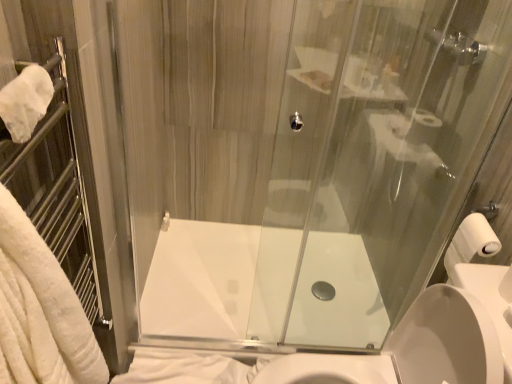
Measure the distance between point (166, 217) and camera.

Point (166, 217) and camera are 7.35 feet apart from each other.

Locate an element on the screen. The image size is (512, 384). white matte towel bar at upper left is located at coordinates (165, 221).

Image resolution: width=512 pixels, height=384 pixels. I want to click on white matte toilet paper at right, so click(x=470, y=244).

Identify the location of toilet paper above the white soft towel at lower left, which is the first bath towel in back-to-front order (from the image's perspective). (470, 244).

Which is more to the right, white matte toilet paper at right or white soft towel at lower left, the 2th bath towel viewed from the top?

white matte toilet paper at right is more to the right.

Does white matte toilet paper at right have a larger size compared to white soft towel at lower left, the 2th bath towel viewed from the top?

Actually, white matte toilet paper at right might be smaller than white soft towel at lower left, the 2th bath towel viewed from the top.

Does point (450, 332) come behind point (36, 324)?

Yes.

In the scene shown: In the image, is white glossy sink at center positioned in front of or behind white soft towel at left, the first bath towel from the front?

white glossy sink at center is positioned farther from the viewer than white soft towel at left, the first bath towel from the front.

At what (x,y) coordinates should I click in order to perform the action: click on sink below the white soft towel at left, the first bath towel from the front (from the image's perspective). Please return your answer as a coordinate pair (x, y). Image resolution: width=512 pixels, height=384 pixels. Looking at the image, I should click on (424, 341).

In terms of width, does transparent glass shower door at center look wider or thinner when compared to white soft towel at left, the second bath towel from the back?

Considering their sizes, transparent glass shower door at center looks slimmer than white soft towel at left, the second bath towel from the back.

Looking at this image, from a real-world perspective, is transparent glass shower door at center positioned above or below white soft towel at left, which appears as the 1th bath towel when viewed from the top?

transparent glass shower door at center is situated lower than white soft towel at left, which appears as the 1th bath towel when viewed from the top, in the real world.

Does transparent glass shower door at center touch white soft towel at left, which appears as the 1th bath towel when viewed from the top?

No, transparent glass shower door at center is not making contact with white soft towel at left, which appears as the 1th bath towel when viewed from the top.

From the image's perspective, is transparent glass shower door at center on white soft towel at left, which appears as the 1th bath towel when viewed from the top?

Yes.

Is white matte towel bar at upper left inside or outside of white soft towel at left, the first bath towel from the front?

The correct answer is: outside.

Does white matte towel bar at upper left have a lesser height compared to white soft towel at left, the second bath towel from the back?

Yes.

From the image's perspective, is white matte towel bar at upper left above white soft towel at left, the first bath towel from the front?

Yes, from the image's perspective, white matte towel bar at upper left is over white soft towel at left, the first bath towel from the front.

Does white matte towel bar at upper left have a greater width compared to white soft towel at left, which appears as the 1th bath towel when viewed from the top?

Incorrect, the width of white matte towel bar at upper left does not surpass that of white soft towel at left, which appears as the 1th bath towel when viewed from the top.

What's the angular difference between white glossy sink at center and white glossy bath at center's facing directions?

The facing directions of white glossy sink at center and white glossy bath at center are 91.1 degrees apart.

Consider the image. Between white glossy sink at center and white glossy bath at center, which one appears on the right side from the viewer's perspective?

From the viewer's perspective, white glossy sink at center appears more on the right side.

Is white glossy sink at center not within white glossy bath at center?

Yes, white glossy sink at center is outside of white glossy bath at center.

Image resolution: width=512 pixels, height=384 pixels. In order to click on sink above the white glossy bath at center (from a real-world perspective) in this screenshot , I will do `click(424, 341)`.

From the image's perspective, which is below, white soft towel at left, which appears as the 1th bath towel when viewed from the top, or white matte towel bar at upper left?

white soft towel at left, which appears as the 1th bath towel when viewed from the top, from the image's perspective.

This screenshot has width=512, height=384. What are the coordinates of `the 2nd bath towel in front of the white matte towel bar at upper left` in the screenshot? It's located at (40, 310).

Considering the relative sizes of white soft towel at left, the second bath towel from the back, and white matte towel bar at upper left in the image provided, is white soft towel at left, the second bath towel from the back, smaller than white matte towel bar at upper left?

Actually, white soft towel at left, the second bath towel from the back, might be larger than white matte towel bar at upper left.

Is white matte towel bar at upper left surrounded by white soft towel at left, which appears as the 1th bath towel when viewed from the top?

No, white matte towel bar at upper left is not a part of white soft towel at left, which appears as the 1th bath towel when viewed from the top.

Is white soft towel at left, the second bath towel positioned from the bottom, in front of or behind white soft towel at lower left, positioned as the second bath towel in front-to-back order, in the image?

Clearly, white soft towel at left, the second bath towel positioned from the bottom, is in front of white soft towel at lower left, positioned as the second bath towel in front-to-back order.

From a real-world perspective, is white soft towel at left, the second bath towel positioned from the bottom, below white soft towel at lower left, which is the first bath towel in back-to-front order?

Incorrect, from a real-world perspective, white soft towel at left, the second bath towel positioned from the bottom, is higher than white soft towel at lower left, which is the first bath towel in back-to-front order.

Is white soft towel at left, the second bath towel from the back, far away from white soft towel at lower left, which is the first bath towel in back-to-front order?

No, white soft towel at left, the second bath towel from the back, is not far away from white soft towel at lower left, which is the first bath towel in back-to-front order.

This screenshot has width=512, height=384. Identify the location of toilet paper on the right of white soft towel at lower left, marked as the first bath towel in a bottom-to-top arrangement. (470, 244).

Where is `bath towel lying in front of the white glossy sink at center`? This screenshot has height=384, width=512. bath towel lying in front of the white glossy sink at center is located at coordinates (40, 310).

Which object lies further to the anchor point white matte toilet paper at right, white soft towel at left, the first bath towel from the front, or white glossy sink at center?

white soft towel at left, the first bath towel from the front, is further to white matte toilet paper at right.

Based on the photo, estimate the real-world distances between objects in this image. Which object is further from white glossy sink at center, transparent glass shower door at center or white glossy bath at center?

The object further to white glossy sink at center is white glossy bath at center.

Considering their positions, is transparent glass shower door at center positioned closer to white soft towel at lower left, the 2th bath towel viewed from the top, than white soft towel at left, which appears as the 1th bath towel when viewed from the top?

Among the two, transparent glass shower door at center is located nearer to white soft towel at lower left, the 2th bath towel viewed from the top.

Which object lies nearer to the anchor point white matte toilet paper at right, white soft towel at lower left, marked as the first bath towel in a bottom-to-top arrangement, or white matte towel bar at upper left?

white soft towel at lower left, marked as the first bath towel in a bottom-to-top arrangement, is closer to white matte toilet paper at right.

When comparing their distances from white soft towel at left, the first bath towel from the front, does transparent glass shower door at center or white soft towel at lower left, which is the first bath towel in back-to-front order, seem closer?

white soft towel at lower left, which is the first bath towel in back-to-front order, is closer to white soft towel at left, the first bath towel from the front.

When comparing their distances from transparent glass shower door at center, does white glossy bath at center or white matte towel bar at upper left seem further?

Based on the image, white matte towel bar at upper left appears to be further to transparent glass shower door at center.

Based on the photo, based on their spatial positions, is white glossy bath at center or white soft towel at lower left, marked as the first bath towel in a bottom-to-top arrangement, closer to white matte towel bar at upper left?

white glossy bath at center is positioned closer to the anchor white matte towel bar at upper left.

Based on their spatial positions, is white glossy bath at center or white matte toilet paper at right further from white glossy sink at center?

white glossy bath at center is positioned further to the anchor white glossy sink at center.

You are a GUI agent. You are given a task and a screenshot of the screen. Output one action in this format:
    pyautogui.click(x=<x>, y=<y>)
    Task: Click on the sink located between white soft towel at lower left, which is the first bath towel in back-to-front order, and white matte toilet paper at right in the left-right direction
    This screenshot has height=384, width=512.
    Given the screenshot: What is the action you would take?
    pyautogui.click(x=424, y=341)

Where is `toilet paper between transparent glass shower door at center and white matte towel bar at upper left along the z-axis`? This screenshot has width=512, height=384. toilet paper between transparent glass shower door at center and white matte towel bar at upper left along the z-axis is located at coordinates (470, 244).

Identify the location of sink between white soft towel at left, which appears as the 1th bath towel when viewed from the top, and white soft towel at lower left, marked as the first bath towel in a bottom-to-top arrangement, from front to back. The width and height of the screenshot is (512, 384). (424, 341).

The image size is (512, 384). I want to click on toilet paper positioned between transparent glass shower door at center and white glossy bath at center from near to far, so click(470, 244).